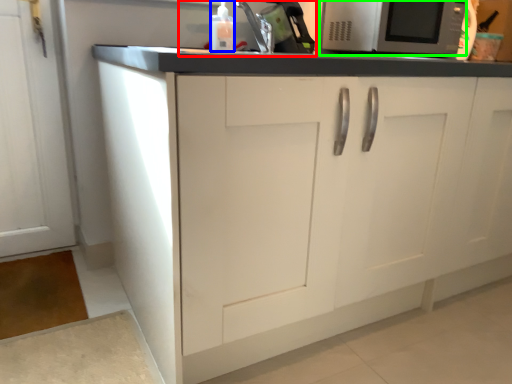
Question: Based on their relative distances, which object is farther from sink (highlighted by a red box)? Choose from bottle (highlighted by a blue box) and microwave oven (highlighted by a green box).

Choices:
 (A) bottle
 (B) microwave oven

Answer: (B)